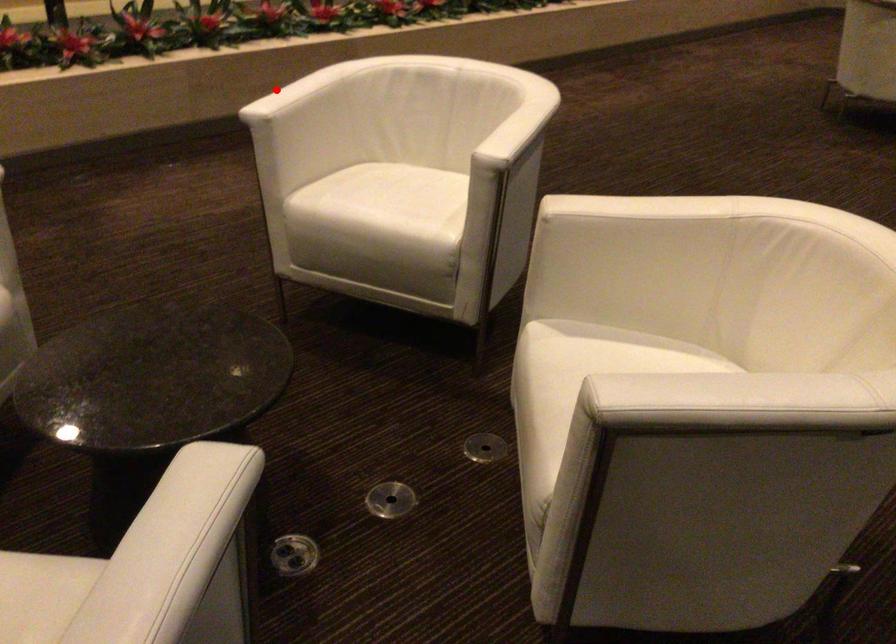
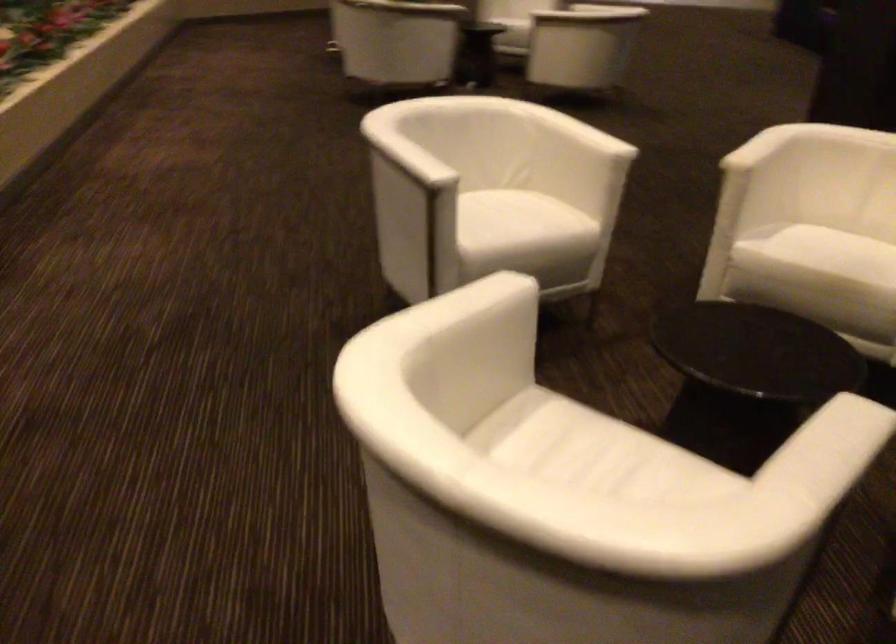
In the second image, find the point that corresponds to the highlighted location in the first image.

(406, 158)